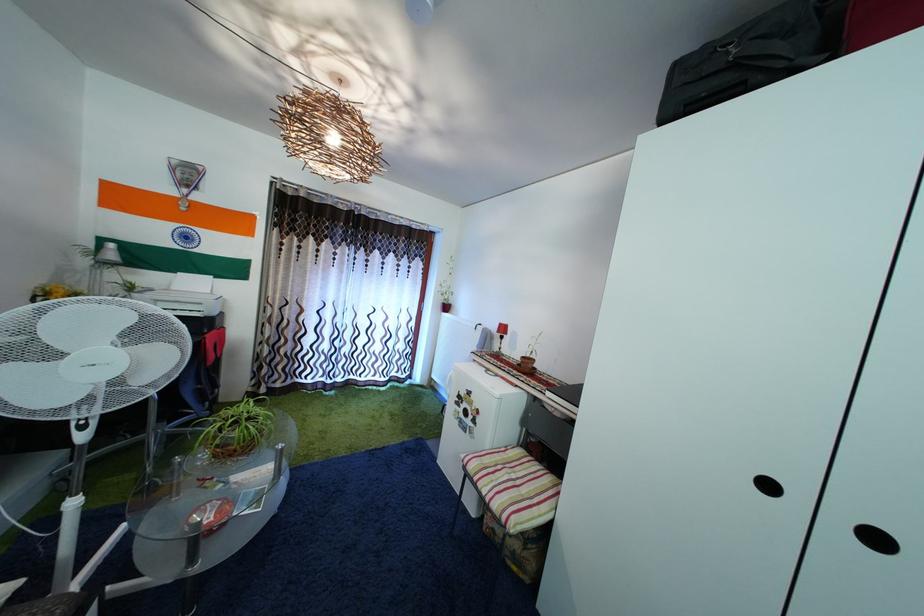
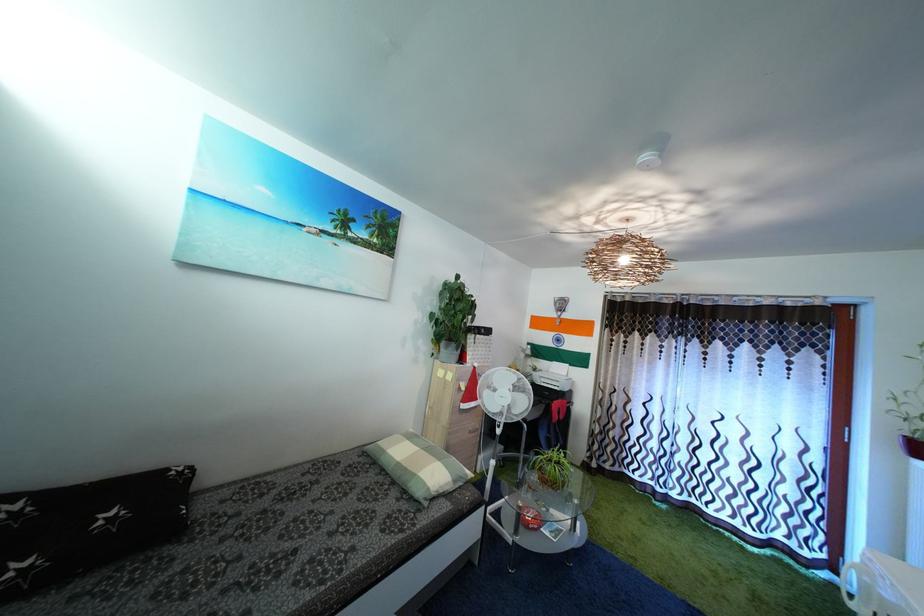
Question: How did the camera likely rotate?

Choices:
 (A) Left
 (B) Right
 (C) Up
 (D) Down

Answer: (A)